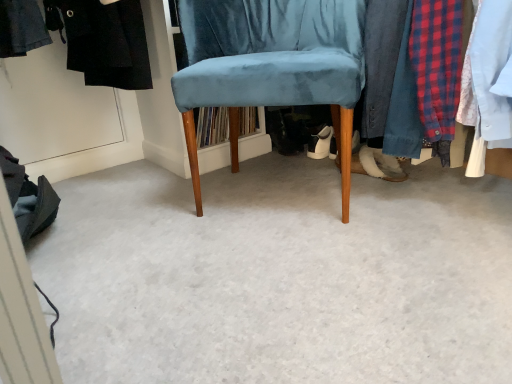
You are a GUI agent. You are given a task and a screenshot of the screen. Output one action in this format:
    pyautogui.click(x=<x>, y=<y>)
    Task: Click on the vacant space to the right of velvet blue chair at center
    The width and height of the screenshot is (512, 384).
    Given the screenshot: What is the action you would take?
    pyautogui.click(x=432, y=202)